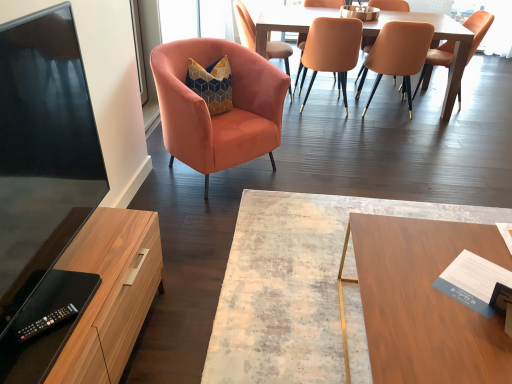
Locate an element on the screen. The width and height of the screenshot is (512, 384). free space to the right of velvet orange armchair at left, the sixth chair viewed from the right is located at coordinates point(310,159).